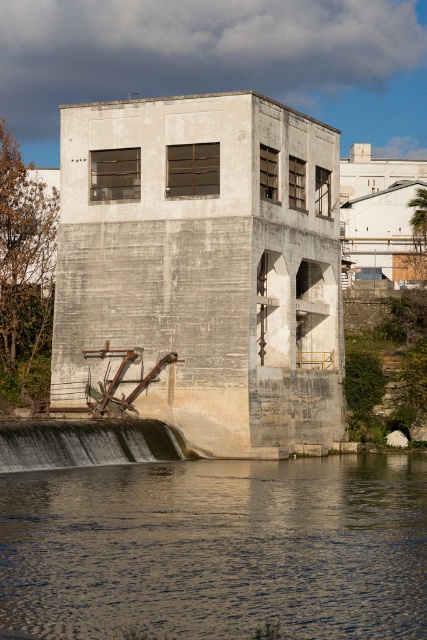
You are standing on a boat in the middle of the lake and see the clear water at lower center and the gray concrete dam at lower left. Which object is closer to you?

The clear water at lower center is closer to you because it is located below the gray concrete dam at lower left, which is positioned higher up.